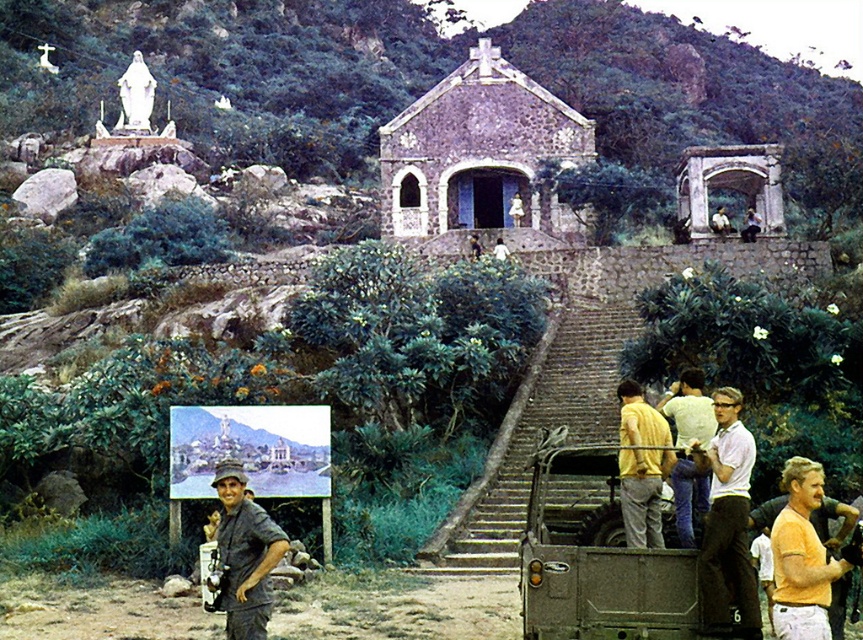
Which is below, white matte shirt at center right or yellow shirt at center?

Positioned lower is white matte shirt at center right.

Does white matte shirt at center right have a larger size compared to yellow shirt at center?

Actually, white matte shirt at center right might be smaller than yellow shirt at center.

The height and width of the screenshot is (640, 863). Describe the element at coordinates (728, 522) in the screenshot. I see `white matte shirt at center right` at that location.

I want to click on white matte shirt at center right, so click(728, 522).

Who is lower down, stone textured church at center or yellow matte shirt at lower right?

yellow matte shirt at lower right is lower down.

Does point (557, 221) come farther from viewer compared to point (671, 477)?

Yes.

Is point (410, 150) less distant than point (687, 436)?

No, it is behind (687, 436).

The width and height of the screenshot is (863, 640). In order to click on stone textured church at center in this screenshot , I will do `click(479, 157)`.

Does stone textured church at center come behind camouflage fabric truck at center?

Yes, stone textured church at center is further from the viewer.

Is stone textured church at center to the left of camouflage fabric truck at center from the viewer's perspective?

Incorrect, stone textured church at center is not on the left side of camouflage fabric truck at center.

Identify the location of stone textured church at center. (479, 157).

Where is `stone textured church at center`? Image resolution: width=863 pixels, height=640 pixels. stone textured church at center is located at coordinates point(479,157).